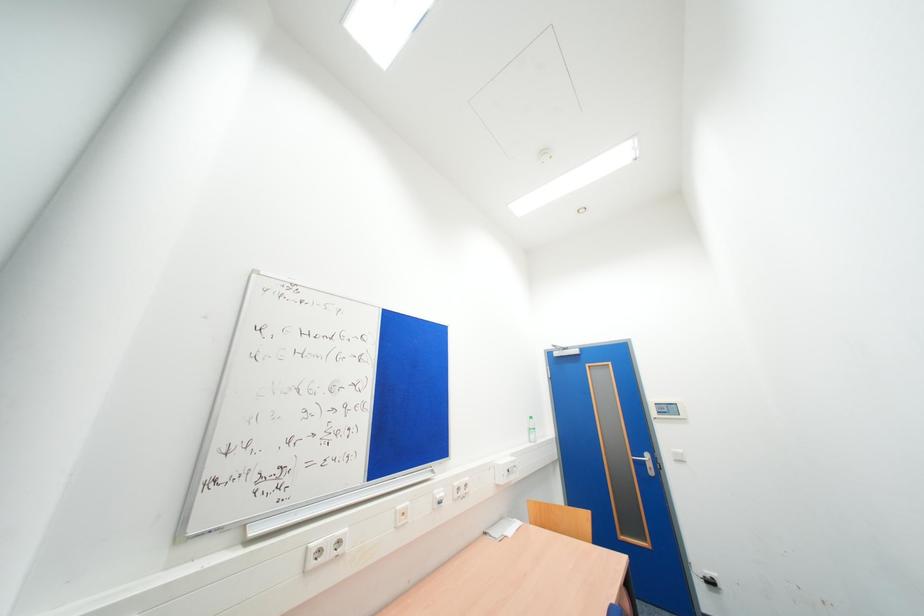
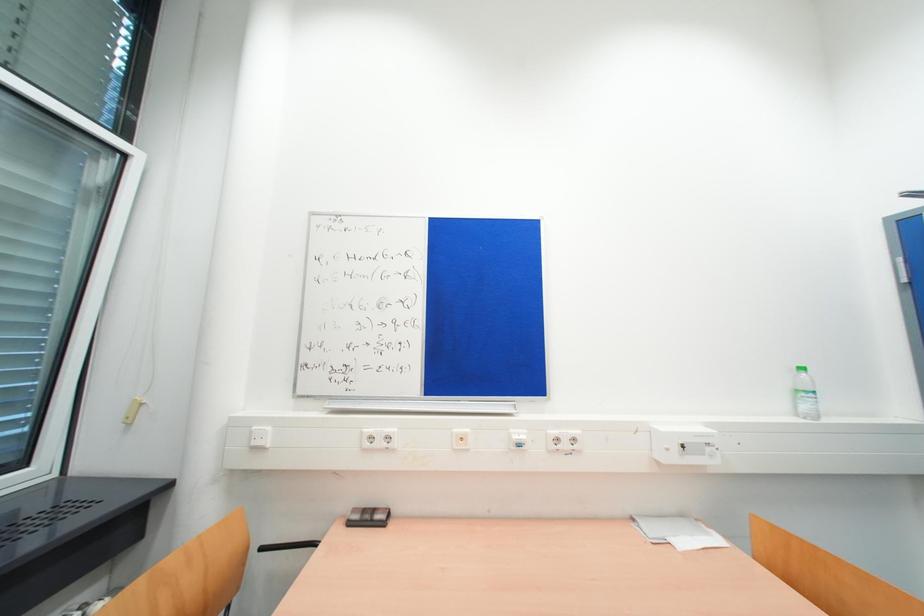
Question: The camera is either moving clockwise (left) or counter-clockwise (right) around the object. The first image is from the beginning of the video and the second image is from the end. Is the camera moving left or right when shooting the video?

Choices:
 (A) Left
 (B) Right

Answer: (B)